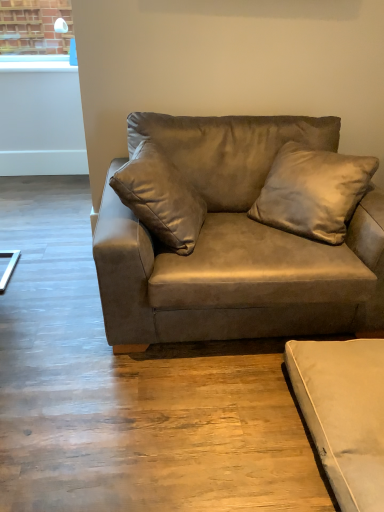
Where is `suede brown couch at center, which is the 2th studio couch in bottom-to-top order`? suede brown couch at center, which is the 2th studio couch in bottom-to-top order is located at coordinates (235, 244).

This screenshot has height=512, width=384. Identify the location of suede brown couch at center, placed as the first studio couch when sorted from top to bottom. (235, 244).

Considering the positions of objects suede brown couch at center, placed as the first studio couch when sorted from top to bottom, and beige suede studio couch at lower right, which is the 1th studio couch from bottom to top, in the image provided, who is more to the right, suede brown couch at center, placed as the first studio couch when sorted from top to bottom, or beige suede studio couch at lower right, which is the 1th studio couch from bottom to top,?

From the viewer's perspective, beige suede studio couch at lower right, which is the 1th studio couch from bottom to top, appears more on the right side.

From the image's perspective, which object appears higher, suede brown couch at center, which is the 2th studio couch in bottom-to-top order, or beige suede studio couch at lower right, which is the 1th studio couch from bottom to top?

From the image's view, suede brown couch at center, which is the 2th studio couch in bottom-to-top order, is above.

Can you see suede brown couch at center, which is the 2th studio couch in bottom-to-top order, touching beige suede studio couch at lower right, which appears as the 2th studio couch when viewed from the top?

No, suede brown couch at center, which is the 2th studio couch in bottom-to-top order, is not making contact with beige suede studio couch at lower right, which appears as the 2th studio couch when viewed from the top.

Based on the photo, is suede brown couch at center, placed as the first studio couch when sorted from top to bottom, bigger or smaller than beige suede studio couch at lower right, which appears as the 2th studio couch when viewed from the top?

Considering their sizes, suede brown couch at center, placed as the first studio couch when sorted from top to bottom, takes up more space than beige suede studio couch at lower right, which appears as the 2th studio couch when viewed from the top.

Can you see suede-like beige pillow at upper center touching suede brown couch at center, which is the 2th studio couch in bottom-to-top order?

No, suede-like beige pillow at upper center is not beside suede brown couch at center, which is the 2th studio couch in bottom-to-top order.

There is a suede-like beige pillow at upper center. Identify the location of the 1st studio couch below it (from the image's perspective). This screenshot has height=512, width=384. (235, 244).

Considering the positions of objects suede-like beige pillow at upper center and suede brown couch at center, which is the 2th studio couch in bottom-to-top order, in the image provided, who is behind, suede-like beige pillow at upper center or suede brown couch at center, which is the 2th studio couch in bottom-to-top order,?

Positioned behind is suede-like beige pillow at upper center.

Can you confirm if suede-like beige pillow at upper center is taller than beige suede studio couch at lower right, which appears as the 2th studio couch when viewed from the top?

Indeed, suede-like beige pillow at upper center has a greater height compared to beige suede studio couch at lower right, which appears as the 2th studio couch when viewed from the top.

Is suede-like beige pillow at upper center spatially inside beige suede studio couch at lower right, which appears as the 2th studio couch when viewed from the top, or outside of it?

suede-like beige pillow at upper center lies outside beige suede studio couch at lower right, which appears as the 2th studio couch when viewed from the top.

Is point (312, 223) farther from viewer compared to point (292, 361)?

Yes, point (312, 223) is behind point (292, 361).

In the image, is suede-like beige pillow at upper center on the left side or the right side of beige suede studio couch at lower right, which is the 1th studio couch from bottom to top?

From the image, it's evident that suede-like beige pillow at upper center is to the left of beige suede studio couch at lower right, which is the 1th studio couch from bottom to top.

Where is `the 2nd studio couch below the suede-like beige pillow at upper center (from a real-world perspective)`? The width and height of the screenshot is (384, 512). the 2nd studio couch below the suede-like beige pillow at upper center (from a real-world perspective) is located at coordinates (344, 413).

From the image's perspective, is beige suede studio couch at lower right, which is the 1th studio couch from bottom to top, beneath suede-like beige pillow at upper center?

Yes, from the image's perspective, beige suede studio couch at lower right, which is the 1th studio couch from bottom to top, is below suede-like beige pillow at upper center.

Is beige suede studio couch at lower right, which is the 1th studio couch from bottom to top, far from suede-like beige pillow at upper center?

No, beige suede studio couch at lower right, which is the 1th studio couch from bottom to top, is not far from suede-like beige pillow at upper center.

Considering the positions of point (331, 424) and point (289, 211), is point (331, 424) closer or farther from the camera than point (289, 211)?

Clearly, point (331, 424) is closer to the camera than point (289, 211).

Can we say beige suede studio couch at lower right, which is the 1th studio couch from bottom to top, lies outside suede brown couch at center, placed as the first studio couch when sorted from top to bottom?

That's correct, beige suede studio couch at lower right, which is the 1th studio couch from bottom to top, is outside of suede brown couch at center, placed as the first studio couch when sorted from top to bottom.

From the image's perspective, which is below, beige suede studio couch at lower right, which is the 1th studio couch from bottom to top, or suede brown couch at center, placed as the first studio couch when sorted from top to bottom?

beige suede studio couch at lower right, which is the 1th studio couch from bottom to top.

Which of these two, beige suede studio couch at lower right, which appears as the 2th studio couch when viewed from the top, or suede brown couch at center, which is the 2th studio couch in bottom-to-top order, is smaller?

beige suede studio couch at lower right, which appears as the 2th studio couch when viewed from the top.

From a real-world perspective, between beige suede studio couch at lower right, which is the 1th studio couch from bottom to top, and suede brown couch at center, which is the 2th studio couch in bottom-to-top order, who is vertically lower?

In real-world perspective, beige suede studio couch at lower right, which is the 1th studio couch from bottom to top, is lower.

Looking at the image, does suede brown couch at center, which is the 2th studio couch in bottom-to-top order, seem bigger or smaller compared to suede-like beige pillow at upper center?

In the image, suede brown couch at center, which is the 2th studio couch in bottom-to-top order, appears to be larger than suede-like beige pillow at upper center.

How distant is suede brown couch at center, which is the 2th studio couch in bottom-to-top order, from suede-like beige pillow at upper center?

A distance of 9.34 inches exists between suede brown couch at center, which is the 2th studio couch in bottom-to-top order, and suede-like beige pillow at upper center.

From the image's perspective, is suede brown couch at center, which is the 2th studio couch in bottom-to-top order, positioned above or below suede-like beige pillow at upper center?

suede brown couch at center, which is the 2th studio couch in bottom-to-top order, is situated lower than suede-like beige pillow at upper center in the image.

Is suede brown couch at center, which is the 2th studio couch in bottom-to-top order, aimed at suede-like beige pillow at upper center?

Yes, suede brown couch at center, which is the 2th studio couch in bottom-to-top order, is aimed at suede-like beige pillow at upper center.

What are the coordinates of `studio couch on the left of beige suede studio couch at lower right, which appears as the 2th studio couch when viewed from the top` in the screenshot? It's located at (235, 244).

Starting from the suede-like beige pillow at upper center, which studio couch is the 1st one in front? Please provide its 2D coordinates.

[(235, 244)]

Looking at the image, which one is located further to suede brown couch at center, which is the 2th studio couch in bottom-to-top order, suede-like beige pillow at upper center or beige suede studio couch at lower right, which appears as the 2th studio couch when viewed from the top?

beige suede studio couch at lower right, which appears as the 2th studio couch when viewed from the top, is positioned further to the anchor suede brown couch at center, which is the 2th studio couch in bottom-to-top order.

Considering their positions, is suede brown couch at center, which is the 2th studio couch in bottom-to-top order, positioned closer to suede-like beige pillow at upper center than beige suede studio couch at lower right, which appears as the 2th studio couch when viewed from the top?

The object closer to suede-like beige pillow at upper center is suede brown couch at center, which is the 2th studio couch in bottom-to-top order.

From the image, which object appears to be farther from beige suede studio couch at lower right, which is the 1th studio couch from bottom to top, suede brown couch at center, which is the 2th studio couch in bottom-to-top order, or suede-like beige pillow at upper center?

suede-like beige pillow at upper center is further to beige suede studio couch at lower right, which is the 1th studio couch from bottom to top.

Looking at the image, which one is located further to suede-like beige pillow at upper center, beige suede studio couch at lower right, which appears as the 2th studio couch when viewed from the top, or suede brown couch at center, placed as the first studio couch when sorted from top to bottom?

beige suede studio couch at lower right, which appears as the 2th studio couch when viewed from the top, lies further to suede-like beige pillow at upper center than the other object.

Estimate the real-world distances between objects in this image. Which object is closer to beige suede studio couch at lower right, which appears as the 2th studio couch when viewed from the top, suede-like beige pillow at upper center or suede brown couch at center, placed as the first studio couch when sorted from top to bottom?

Based on the image, suede brown couch at center, placed as the first studio couch when sorted from top to bottom, appears to be nearer to beige suede studio couch at lower right, which appears as the 2th studio couch when viewed from the top.

Estimate the real-world distances between objects in this image. Which object is closer to suede brown couch at center, which is the 2th studio couch in bottom-to-top order, beige suede studio couch at lower right, which appears as the 2th studio couch when viewed from the top, or suede-like beige pillow at upper center?

The object closer to suede brown couch at center, which is the 2th studio couch in bottom-to-top order, is suede-like beige pillow at upper center.

This screenshot has height=512, width=384. I want to click on studio couch between suede-like beige pillow at upper center and beige suede studio couch at lower right, which appears as the 2th studio couch when viewed from the top, in the vertical direction, so click(x=235, y=244).